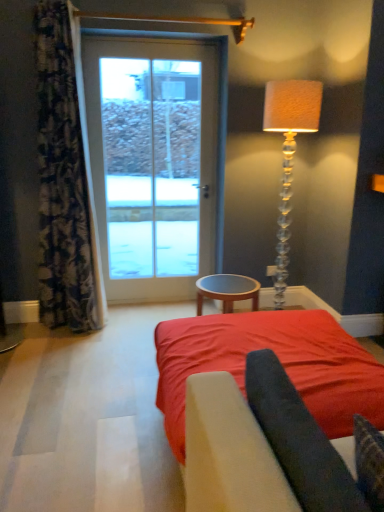
The image size is (384, 512). What are the coordinates of `vacant space situated above red fabric bed at center (from a real-world perspective)` in the screenshot? It's located at (264, 336).